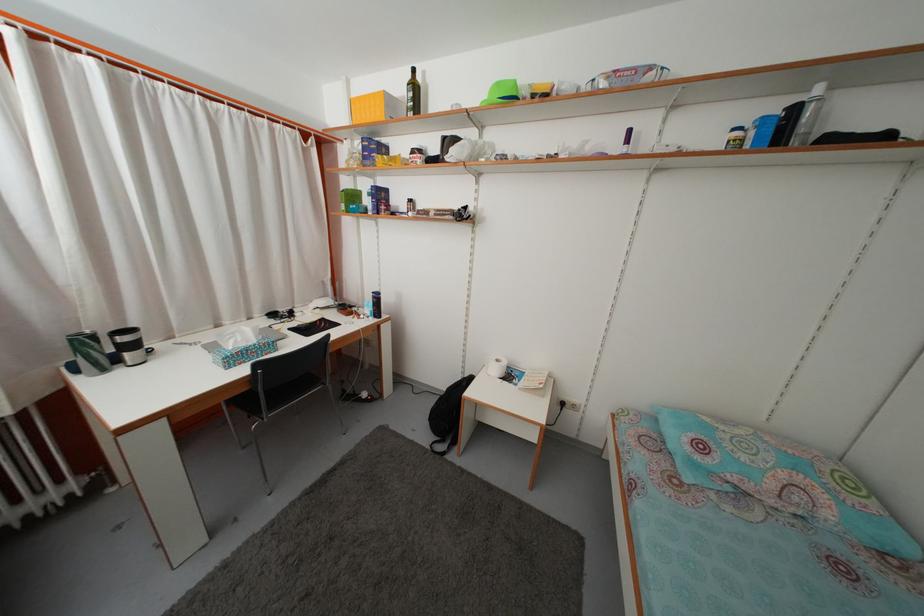
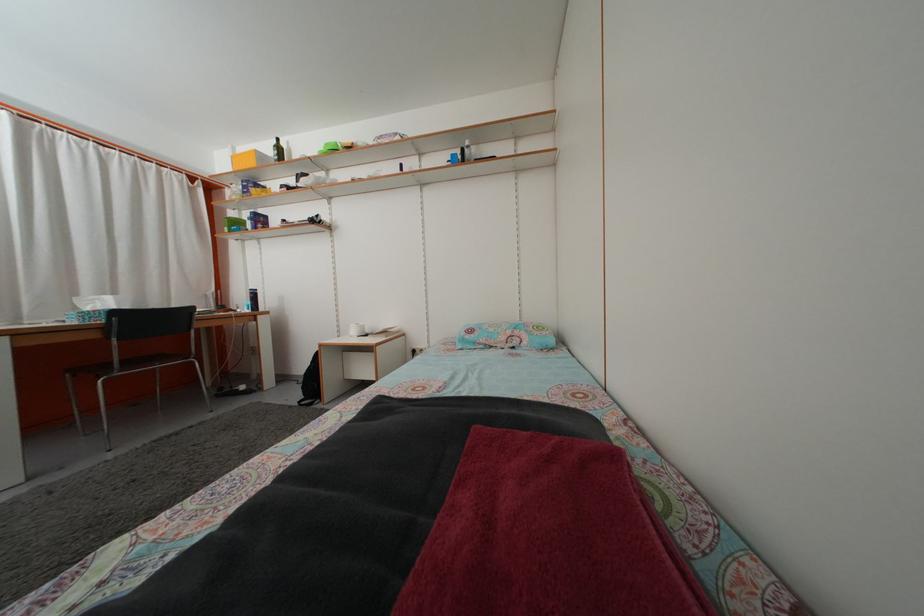
Where in the second image is the point corresponding to point (415, 83) from the first image?

(281, 148)